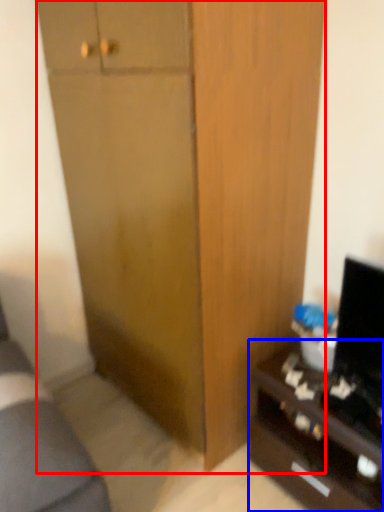
Question: Which of the following is the closest to the observer, cabinetry (highlighted by a red box) or desk (highlighted by a blue box)?

Choices:
 (A) cabinetry
 (B) desk

Answer: (A)